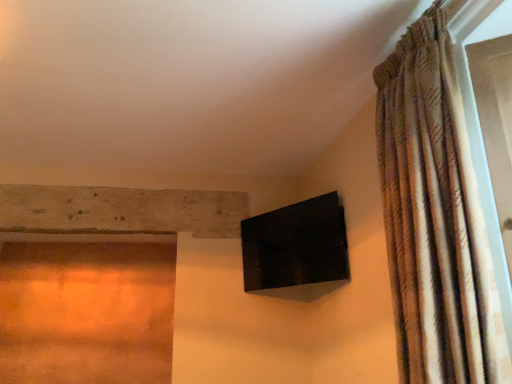
Question: Should I look upward or downward to see textured beige curtain at right?

Choices:
 (A) down
 (B) up

Answer: (A)